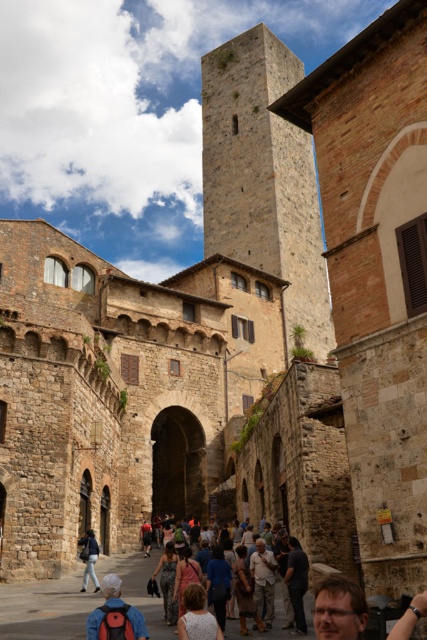
Can you confirm if rustic stone tower at center is smaller than denim jacket at center?

Incorrect, rustic stone tower at center is not smaller in size than denim jacket at center.

What do you see at coordinates (263, 177) in the screenshot? This screenshot has height=640, width=427. I see `rustic stone tower at center` at bounding box center [263, 177].

Is point (215, 250) closer to viewer compared to point (169, 592)?

That is False.

You are a GUI agent. You are given a task and a screenshot of the screen. Output one action in this format:
    pyautogui.click(x=<x>, y=<y>)
    Task: Click on the rustic stone tower at center
    
    Given the screenshot: What is the action you would take?
    pyautogui.click(x=263, y=177)

Does red backpack at lower left have a greater height compared to denim jacket at center?

Indeed, red backpack at lower left has a greater height compared to denim jacket at center.

Is red backpack at lower left positioned at the back of denim jacket at center?

No.

Is point (128, 616) positioned before point (169, 577)?

Yes.

The width and height of the screenshot is (427, 640). I want to click on red backpack at lower left, so click(x=105, y=604).

How far apart are dark gray stone crowd at center and dark gray fabric at lower center?

The distance of dark gray stone crowd at center from dark gray fabric at lower center is 24.65 feet.

Can you confirm if dark gray stone crowd at center is smaller than dark gray fabric at lower center?

Actually, dark gray stone crowd at center might be larger than dark gray fabric at lower center.

Is point (260, 637) closer to camera compared to point (307, 566)?

That is True.

Image resolution: width=427 pixels, height=640 pixels. Identify the location of dark gray stone crowd at center. (149, 596).